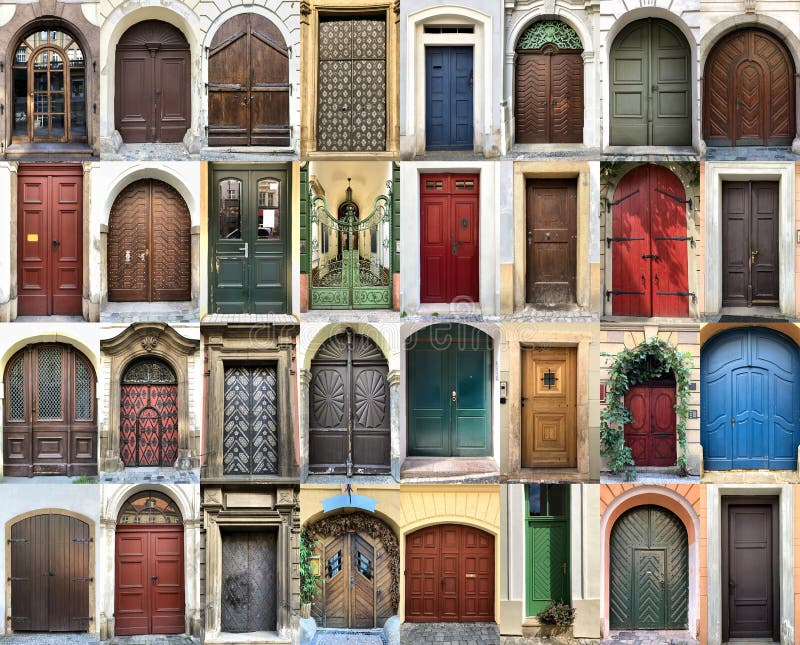
Locate an element on the screen. red doors in the photograph is located at coordinates (56, 233), (158, 553), (450, 258), (644, 240), (662, 433).